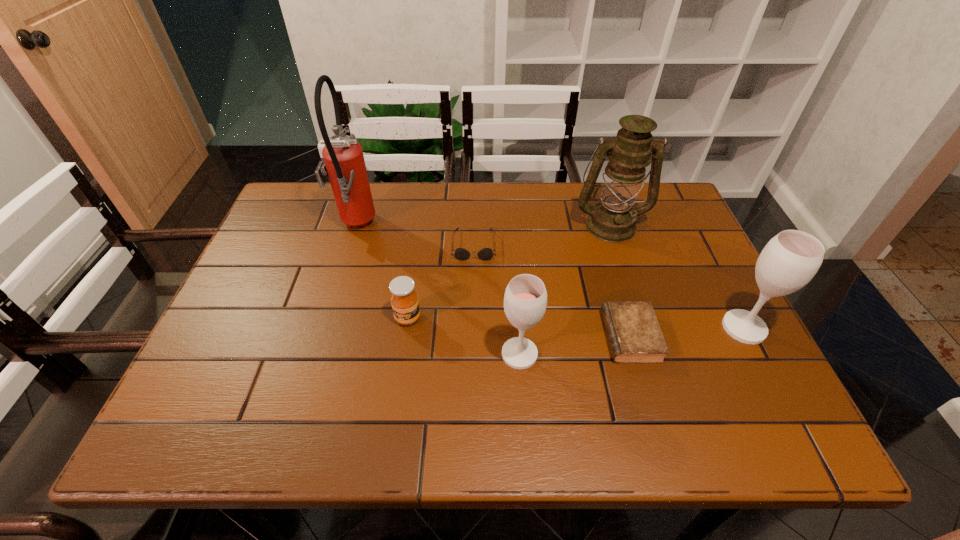
This screenshot has width=960, height=540. What are the coordinates of `vacant space at the left edge of the desktop` in the screenshot? It's located at (245, 274).

In the image, there is a desktop. At what (x,y) coordinates should I click in order to perform the action: click on vacant space at the right edge. Please return your answer as a coordinate pair (x, y). Looking at the image, I should click on (715, 343).

This screenshot has width=960, height=540. In the image, there is a desktop. In order to click on vacant region at the far left corner in this screenshot , I will do `click(289, 203)`.

This screenshot has width=960, height=540. In the image, there is a desktop. Identify the location of vacant space at the near left corner. (270, 362).

You are a GUI agent. You are given a task and a screenshot of the screen. Output one action in this format:
    pyautogui.click(x=<x>, y=<y>)
    Task: Click on the vacant space at the near right corner
    The width and height of the screenshot is (960, 540).
    Given the screenshot: What is the action you would take?
    pyautogui.click(x=701, y=381)

Find the location of `vacant area that lies between the fire extinguisher and the second object from left to right`. vacant area that lies between the fire extinguisher and the second object from left to right is located at coordinates (381, 272).

Identify the location of unoccupied area between the second tallest object and the sunglasses. The width and height of the screenshot is (960, 540). (542, 235).

This screenshot has width=960, height=540. What are the coordinates of `vacant area that lies between the rightmost object and the diary` in the screenshot? It's located at (687, 332).

Locate an element on the screen. This screenshot has width=960, height=540. vacant point located between the diary and the shorter wineglass is located at coordinates (575, 345).

Where is `free space between the diary and the oil lamp`? free space between the diary and the oil lamp is located at coordinates (620, 281).